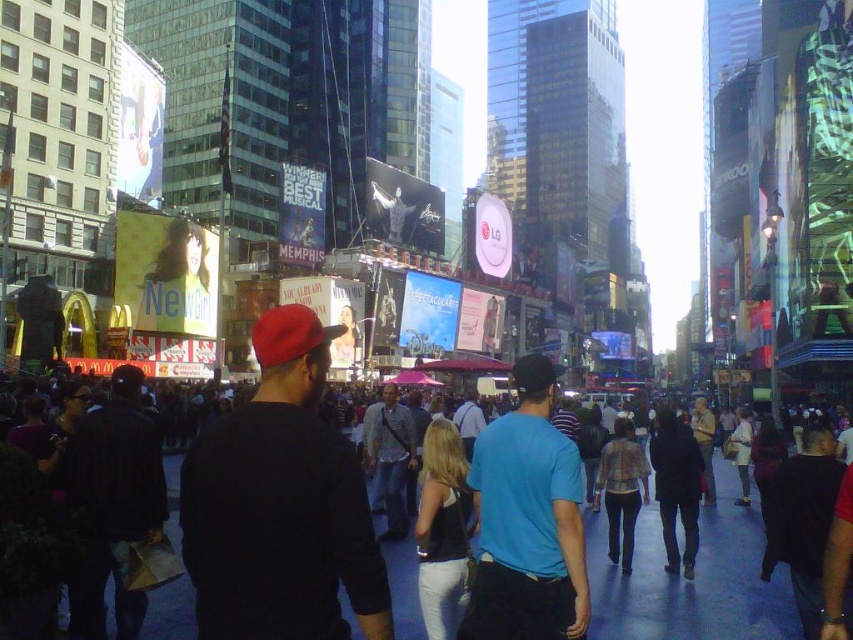
Which is more to the left, matte black shirt at center or black cotton crowd at center?

Positioned to the left is matte black shirt at center.

This screenshot has width=853, height=640. What do you see at coordinates (280, 504) in the screenshot?
I see `matte black shirt at center` at bounding box center [280, 504].

Does point (196, 500) lie behind point (595, 634)?

No, it is not.

Where is `matte black shirt at center`? The height and width of the screenshot is (640, 853). matte black shirt at center is located at coordinates (280, 504).

The image size is (853, 640). Describe the element at coordinates (622, 490) in the screenshot. I see `plaid shirt at center` at that location.

Is plaid shirt at center above metallic statue at center?

No, plaid shirt at center is not above metallic statue at center.

Is point (607, 458) more distant than point (396, 224)?

No, (607, 458) is in front of (396, 224).

Find the location of a particular element. This screenshot has height=640, width=853. plaid shirt at center is located at coordinates (622, 490).

Which is more to the left, matte black shirt at center or metallic statue at center?

Positioned to the left is matte black shirt at center.

Is matte black shirt at center positioned behind metallic statue at center?

No, it is not.

Is point (228, 445) positioned behind point (374, 208)?

That is False.

Locate an element on the screen. matte black shirt at center is located at coordinates (280, 504).